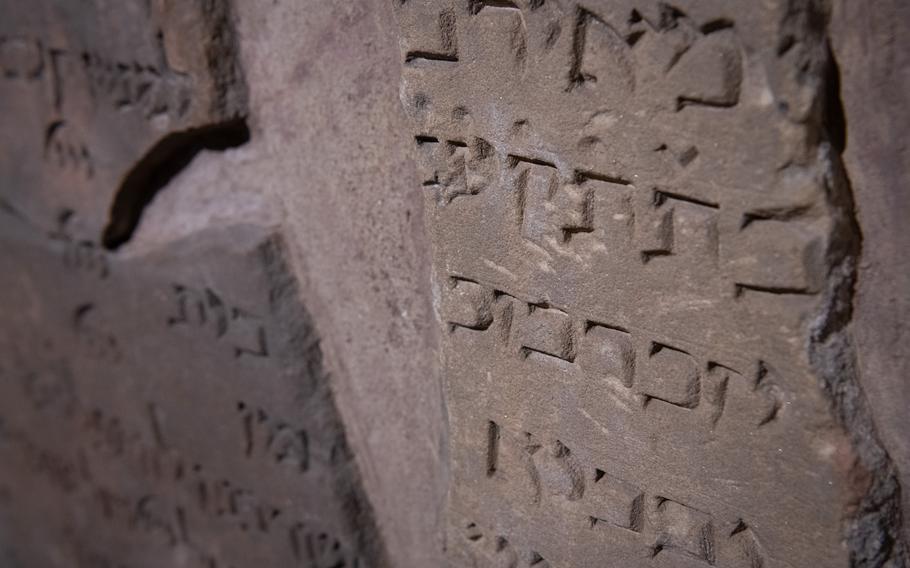
Image resolution: width=910 pixels, height=568 pixels. Find the location of `right of tablet`. right of tablet is located at coordinates (882, 221).